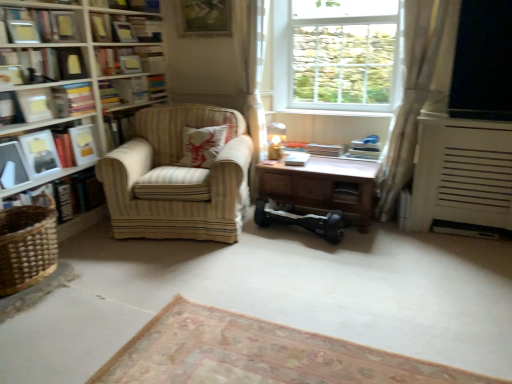
This screenshot has width=512, height=384. I want to click on vacant space that's between white checkered curtain at center, positioned as the 2th curtain in right-to-left order, and carpeted floor at lower center, the 2th plain positioned from the front, so click(279, 287).